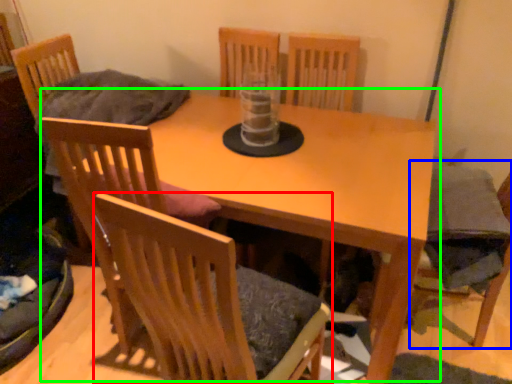
Question: Based on their relative distances, which object is nearer to chair (highlighted by a red box)? Choose from armchair (highlighted by a blue box) and table (highlighted by a green box).

Choices:
 (A) armchair
 (B) table

Answer: (B)